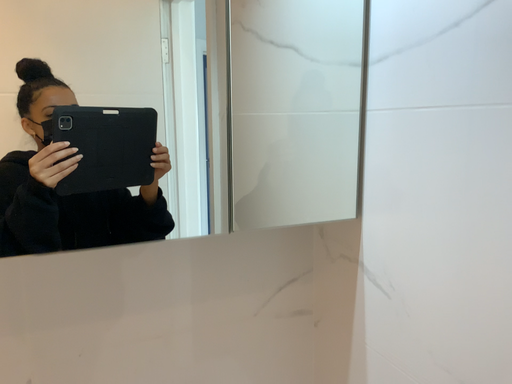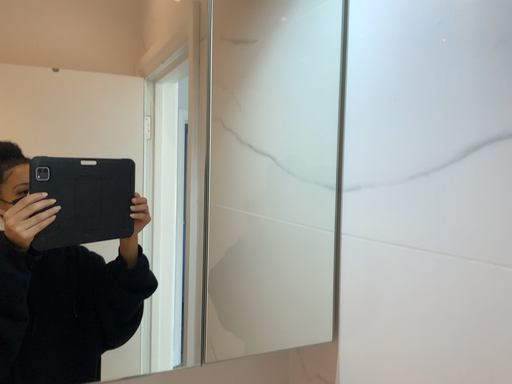
Question: How did the camera likely rotate when shooting the video?

Choices:
 (A) rotated upward
 (B) rotated downward

Answer: (A)